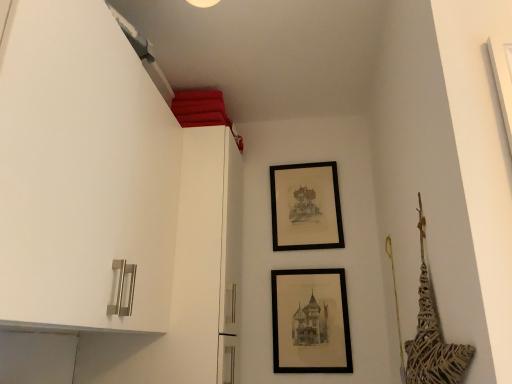
Question: Based on their sizes in the image, would you say matte black picture frame at center, acting as the first picture frame starting from the bottom, is bigger or smaller than black matte picture frame at upper center, which appears as the first picture frame when viewed from the back?

Choices:
 (A) small
 (B) big

Answer: (A)

Question: In terms of width, does matte black picture frame at center, the 2th picture frame from the top, look wider or thinner when compared to black matte picture frame at upper center, which appears as the first picture frame when viewed from the back?

Choices:
 (A) wide
 (B) thin

Answer: (B)

Question: Visually, is matte black picture frame at center, the 2th picture frame from the top, positioned to the left or to the right of black matte picture frame at upper center, which is the second picture frame from front to back?

Choices:
 (A) right
 (B) left

Answer: (B)

Question: Is point (289, 172) positioned closer to the camera than point (330, 334)?

Choices:
 (A) closer
 (B) farther

Answer: (B)

Question: From a real-world perspective, is black matte picture frame at upper center, which is the second picture frame from front to back, physically located above or below matte black picture frame at center, which appears as the second picture frame when viewed from the back?

Choices:
 (A) below
 (B) above

Answer: (B)

Question: Considering the positions of black matte picture frame at upper center, which is the second picture frame from front to back, and matte black picture frame at center, acting as the first picture frame starting from the bottom, in the image, is black matte picture frame at upper center, which is the second picture frame from front to back, wider or thinner than matte black picture frame at center, acting as the first picture frame starting from the bottom,?

Choices:
 (A) wide
 (B) thin

Answer: (A)

Question: From their relative heights in the image, would you say black matte picture frame at upper center, which is the second picture frame from front to back, is taller or shorter than matte black picture frame at center, the 2th picture frame from the top?

Choices:
 (A) short
 (B) tall

Answer: (B)